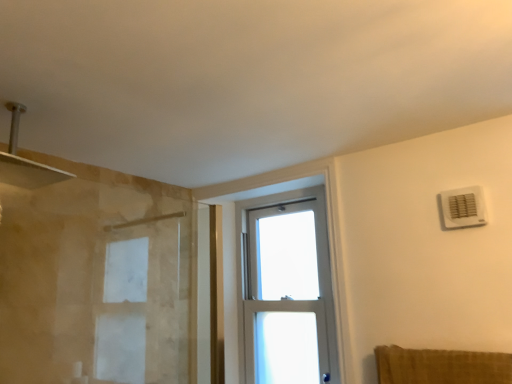
Question: Can you confirm if white plastic air conditioning unit at upper right is thinner than clear glass window at center?

Choices:
 (A) yes
 (B) no

Answer: (A)

Question: Can you confirm if white plastic air conditioning unit at upper right is positioned to the left of clear glass window at center?

Choices:
 (A) no
 (B) yes

Answer: (A)

Question: From a real-world perspective, is white plastic air conditioning unit at upper right on top of clear glass window at center?

Choices:
 (A) no
 (B) yes

Answer: (B)

Question: Is white plastic air conditioning unit at upper right shorter than clear glass window at center?

Choices:
 (A) no
 (B) yes

Answer: (B)

Question: From the image's perspective, would you say white plastic air conditioning unit at upper right is positioned over clear glass window at center?

Choices:
 (A) no
 (B) yes

Answer: (B)

Question: Is white plastic air conditioning unit at upper right behind clear glass window at center?

Choices:
 (A) no
 (B) yes

Answer: (A)

Question: Is clear glass window at center positioned behind white plastic air conditioning unit at upper right?

Choices:
 (A) yes
 (B) no

Answer: (A)

Question: Is clear glass window at center at the right side of white plastic air conditioning unit at upper right?

Choices:
 (A) no
 (B) yes

Answer: (A)

Question: Does clear glass window at center have a lesser height compared to white plastic air conditioning unit at upper right?

Choices:
 (A) yes
 (B) no

Answer: (B)

Question: From a real-world perspective, is clear glass window at center positioned under white plastic air conditioning unit at upper right based on gravity?

Choices:
 (A) no
 (B) yes

Answer: (B)

Question: Is clear glass window at center taller than white plastic air conditioning unit at upper right?

Choices:
 (A) no
 (B) yes

Answer: (B)

Question: Does clear glass window at center have a larger size compared to white plastic air conditioning unit at upper right?

Choices:
 (A) yes
 (B) no

Answer: (A)

Question: Considering the relative positions of white plastic air conditioning unit at upper right and clear glass window at center in the image provided, is white plastic air conditioning unit at upper right to the left or to the right of clear glass window at center?

Choices:
 (A) left
 (B) right

Answer: (B)